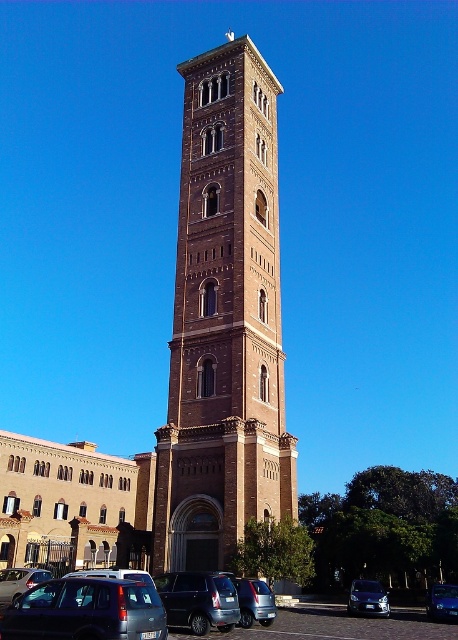
Which is in front, point (245, 620) or point (367, 589)?

Point (245, 620) is in front.

Does metallic silver car at lower center have a lesser height compared to metallic blue sedan at lower center?

Correct, metallic silver car at lower center is not as tall as metallic blue sedan at lower center.

Does point (273, 611) come closer to viewer compared to point (352, 602)?

Yes, it is.

Find the location of a particular element. This screenshot has width=458, height=640. metallic silver car at lower center is located at coordinates (255, 602).

Which of these two, metallic blue sedan at lower center or metallic silver car at lower left, stands shorter?

metallic blue sedan at lower center is shorter.

The height and width of the screenshot is (640, 458). Describe the element at coordinates (367, 598) in the screenshot. I see `metallic blue sedan at lower center` at that location.

The height and width of the screenshot is (640, 458). What do you see at coordinates (367, 598) in the screenshot? I see `metallic blue sedan at lower center` at bounding box center [367, 598].

Identify the location of metallic blue sedan at lower center. (367, 598).

Can you confirm if brown brick tower at center is wider than metallic gray van at lower left?

Yes, brown brick tower at center is wider than metallic gray van at lower left.

In the scene shown: How far apart are brown brick tower at center and metallic gray van at lower left?

brown brick tower at center and metallic gray van at lower left are 65.80 feet apart.

Between point (232, 221) and point (59, 588), which one is positioned behind?

Point (232, 221)

At what (x,y) coordinates should I click in order to perform the action: click on brown brick tower at center. Please return your answer as a coordinate pair (x, y). The image size is (458, 640). Looking at the image, I should click on (224, 321).